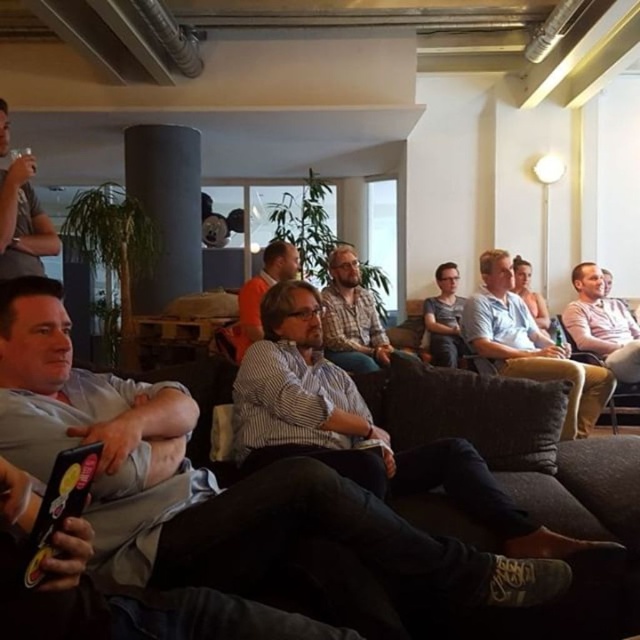
How far apart are matte gray shirt at upper left and matte gray shirt at center?

A distance of 11.01 feet exists between matte gray shirt at upper left and matte gray shirt at center.

What do you see at coordinates (22, 221) in the screenshot? This screenshot has height=640, width=640. I see `matte gray shirt at upper left` at bounding box center [22, 221].

At what (x,y) coordinates should I click in order to perform the action: click on matte gray shirt at upper left. Please return your answer as a coordinate pair (x, y). The width and height of the screenshot is (640, 640). Looking at the image, I should click on (22, 221).

Is light blue shirt at center above pink cotton shirt at right?

No, light blue shirt at center is not above pink cotton shirt at right.

In the scene shown: Does light blue shirt at center appear on the left side of pink cotton shirt at right?

Correct, you'll find light blue shirt at center to the left of pink cotton shirt at right.

The height and width of the screenshot is (640, 640). In order to click on light blue shirt at center in this screenshot , I will do `click(529, 346)`.

You are a GUI agent. You are given a task and a screenshot of the screen. Output one action in this format:
    pyautogui.click(x=<x>, y=<y>)
    Task: Click on the light blue shirt at center
    
    Given the screenshot: What is the action you would take?
    [x=529, y=346]

Can you confirm if matte gray shirt at upper left is positioned to the left of matte white shirt at center?

Correct, you'll find matte gray shirt at upper left to the left of matte white shirt at center.

Which is below, matte gray shirt at upper left or matte white shirt at center?

Positioned lower is matte white shirt at center.

Does point (3, 260) lie behind point (541, 323)?

No.

I want to click on matte gray shirt at upper left, so click(22, 221).